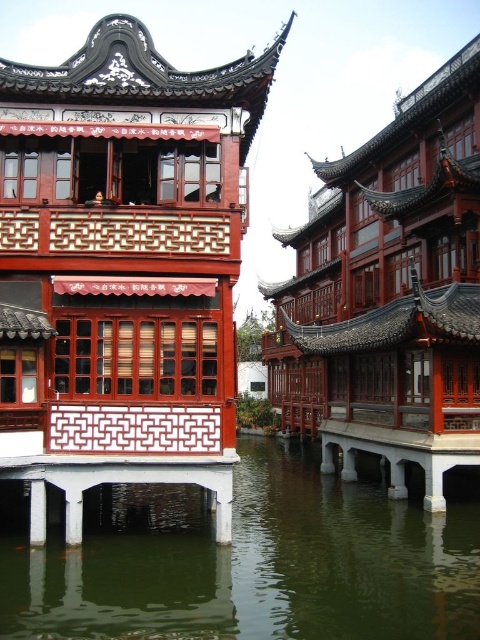
Question: Is matte wood palace at center to the right of green translucent water at lower center from the viewer's perspective?

Choices:
 (A) no
 (B) yes

Answer: (A)

Question: Which object is positioned closest to the polished wood palace at center?

Choices:
 (A) matte wood palace at center
 (B) white glossy pillar at lower center

Answer: (A)

Question: Estimate the real-world distances between objects in this image. Which object is farther from the polished wood palace at center?

Choices:
 (A) white glossy pillar at lower center
 (B) matte wood palace at center
 (C) green translucent water at lower center
 (D) white glossy pillar at lower left

Answer: (D)

Question: Does green translucent water at lower center have a lesser width compared to white glossy pillar at lower left?

Choices:
 (A) yes
 (B) no

Answer: (B)

Question: Among these points, which one is farthest from the camera?

Choices:
 (A) (397, 385)
 (B) (38, 516)

Answer: (A)

Question: Can you confirm if matte wood palace at center is positioned to the left of white glossy pillar at lower center?

Choices:
 (A) no
 (B) yes

Answer: (A)